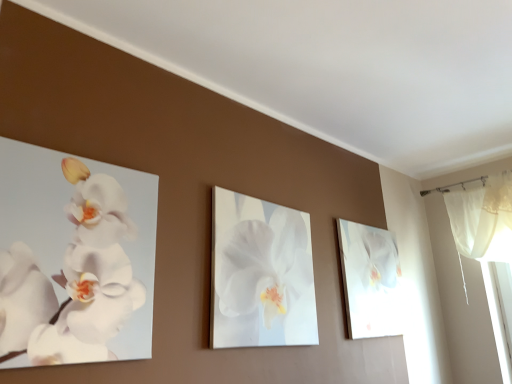
Question: From a real-world perspective, is white matte orchid at left, which appears as the first flower when viewed from the left, physically located above or below white glossy orchid painting at right?

Choices:
 (A) below
 (B) above

Answer: (A)

Question: Would you say white matte orchid at left, which is the 1th flower from front to back, is to the left or to the right of white glossy orchid painting at right in the picture?

Choices:
 (A) left
 (B) right

Answer: (A)

Question: Based on their relative distances, which object is nearer to the white glossy orchid painting at right?

Choices:
 (A) white glossy orchid at center, which is the first flower from right to left
 (B) white matte orchid at left, which is the 1th flower from front to back

Answer: (A)

Question: Based on their relative distances, which object is nearer to the white glossy orchid painting at right?

Choices:
 (A) white glossy orchid at center, the 2th flower positioned from the front
 (B) white matte orchid at left, which appears as the first flower when viewed from the left

Answer: (A)